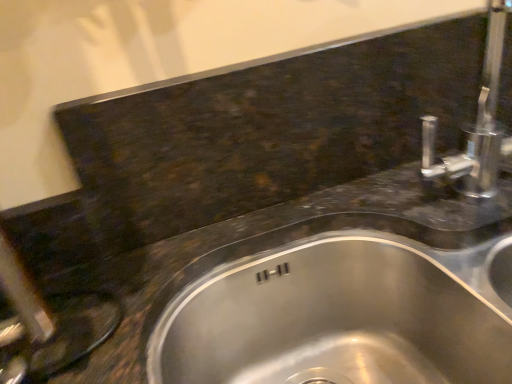
Question: Should I look upward or downward to see stainless steel sink at center?

Choices:
 (A) up
 (B) down

Answer: (B)